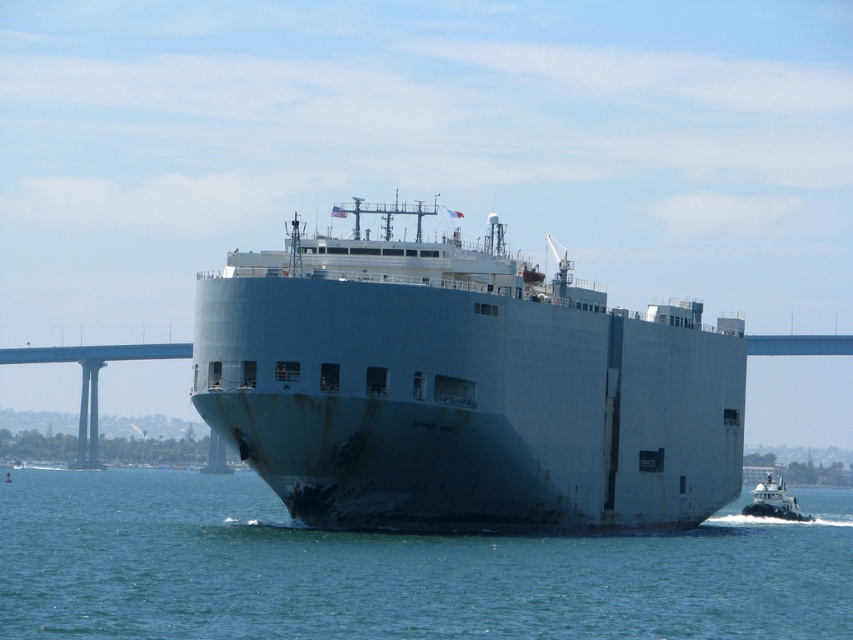
Who is positioned more to the right, blue water at center or white glossy tugboat at lower right?

Positioned to the right is white glossy tugboat at lower right.

Is blue water at center to the left of white glossy tugboat at lower right from the viewer's perspective?

Indeed, blue water at center is positioned on the left side of white glossy tugboat at lower right.

Which is behind, point (492, 548) or point (764, 506)?

Positioned behind is point (764, 506).

Image resolution: width=853 pixels, height=640 pixels. Identify the location of blue water at center. (392, 570).

Who is more forward, (688, 513) or (750, 506)?

Positioned in front is point (688, 513).

Is gray matte cargo ship at center to the left of white glossy tugboat at lower right from the viewer's perspective?

Indeed, gray matte cargo ship at center is positioned on the left side of white glossy tugboat at lower right.

Is point (440, 522) positioned before point (775, 502)?

That is True.

Identify the location of gray matte cargo ship at center. The image size is (853, 640). (463, 388).

Can you confirm if gray matte cargo ship at center is positioned below blue water at center?

Actually, gray matte cargo ship at center is above blue water at center.

Is point (338, 244) more distant than point (527, 552)?

That is True.

The width and height of the screenshot is (853, 640). What do you see at coordinates (463, 388) in the screenshot? I see `gray matte cargo ship at center` at bounding box center [463, 388].

Image resolution: width=853 pixels, height=640 pixels. What are the coordinates of `gray matte cargo ship at center` in the screenshot? It's located at (463, 388).